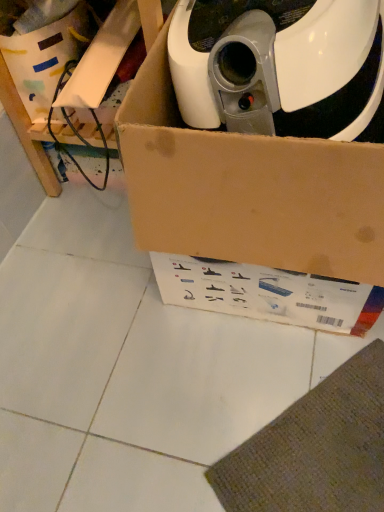
Describe the element at coordinates (248, 189) in the screenshot. The height and width of the screenshot is (512, 384). I see `brown cardboard box at upper center` at that location.

Locate an element on the screen. brown cardboard box at upper left is located at coordinates (108, 64).

The height and width of the screenshot is (512, 384). Identify the location of brown cardboard box at upper center. (248, 189).

Can you confirm if brown cardboard box at upper center is wider than white cardboard box at upper left?

Yes, brown cardboard box at upper center is wider than white cardboard box at upper left.

Is brown cardboard box at upper center to the right of white cardboard box at upper left from the viewer's perspective?

Yes.

Which is in front, brown cardboard box at upper center or white cardboard box at upper left?

brown cardboard box at upper center is in front.

Where is `storage box behind the brown cardboard box at upper center`? Image resolution: width=384 pixels, height=512 pixels. storage box behind the brown cardboard box at upper center is located at coordinates (43, 59).

Is brown cardboard box at upper left facing towards white cardboard box at upper left?

Yes, brown cardboard box at upper left faces towards white cardboard box at upper left.

Would you say brown cardboard box at upper left is outside white cardboard box at upper left?

Yes, brown cardboard box at upper left is not within white cardboard box at upper left.

How many degrees apart are the facing directions of brown cardboard box at upper left and white cardboard box at upper left?

5.06 degrees separate the facing orientations of brown cardboard box at upper left and white cardboard box at upper left.

Which is behind, brown cardboard box at upper left or white cardboard box at upper left?

white cardboard box at upper left is further away from the camera.

From a real-world perspective, is brown cardboard box at upper left beneath brown cardboard box at upper center?

Yes, from a real-world perspective, brown cardboard box at upper left is under brown cardboard box at upper center.

Looking at this image, is brown cardboard box at upper left shorter than brown cardboard box at upper center?

In fact, brown cardboard box at upper left may be taller than brown cardboard box at upper center.

Is brown cardboard box at upper left to the left of brown cardboard box at upper center from the viewer's perspective?

Indeed, brown cardboard box at upper left is positioned on the left side of brown cardboard box at upper center.

Does brown cardboard box at upper left come in front of brown cardboard box at upper center?

No, brown cardboard box at upper left is further to the viewer.

Is white cardboard box at upper left positioned before brown cardboard box at upper center?

No, white cardboard box at upper left is behind brown cardboard box at upper center.

Would you say white cardboard box at upper left contains brown cardboard box at upper center?

Actually, brown cardboard box at upper center is outside white cardboard box at upper left.

From a real-world perspective, between white cardboard box at upper left and brown cardboard box at upper center, who is vertically higher?

brown cardboard box at upper center is physically above.

Is white cardboard box at upper left shorter than brown cardboard box at upper center?

Correct, white cardboard box at upper left is not as tall as brown cardboard box at upper center.

Considering the sizes of objects white cardboard box at upper left and brown cardboard box at upper left in the image provided, who is thinner, white cardboard box at upper left or brown cardboard box at upper left?

Thinner between the two is white cardboard box at upper left.

From the image's perspective, is white cardboard box at upper left positioned above or below brown cardboard box at upper left?

Clearly, from the image's perspective, white cardboard box at upper left is above brown cardboard box at upper left.

Would you say white cardboard box at upper left is inside or outside brown cardboard box at upper left?

white cardboard box at upper left is contained in brown cardboard box at upper left.

Is brown cardboard box at upper center not near brown cardboard box at upper left?

No, brown cardboard box at upper center is in close proximity to brown cardboard box at upper left.

Is brown cardboard box at upper left a part of brown cardboard box at upper center?

No, brown cardboard box at upper left is not inside brown cardboard box at upper center.

Locate an element on the screen. The width and height of the screenshot is (384, 512). box in front of the white cardboard box at upper left is located at coordinates (248, 189).

I want to click on furniture below the white cardboard box at upper left (from the image's perspective), so click(x=108, y=64).

Looking at the image, which one is located closer to brown cardboard box at upper center, white cardboard box at upper left or brown cardboard box at upper left?

brown cardboard box at upper left is closer to brown cardboard box at upper center.

Based on their spatial positions, is brown cardboard box at upper left or brown cardboard box at upper center further from white cardboard box at upper left?

The object further to white cardboard box at upper left is brown cardboard box at upper center.

When comparing their distances from brown cardboard box at upper center, does brown cardboard box at upper left or white cardboard box at upper left seem further?

The object further to brown cardboard box at upper center is white cardboard box at upper left.

Which object lies nearer to the anchor point white cardboard box at upper left, brown cardboard box at upper center or brown cardboard box at upper left?

brown cardboard box at upper left is positioned closer to the anchor white cardboard box at upper left.

Estimate the real-world distances between objects in this image. Which object is further from brown cardboard box at upper left, brown cardboard box at upper center or white cardboard box at upper left?

Based on the image, brown cardboard box at upper center appears to be further to brown cardboard box at upper left.

Estimate the real-world distances between objects in this image. Which object is further from brown cardboard box at upper left, white cardboard box at upper left or brown cardboard box at upper center?

brown cardboard box at upper center lies further to brown cardboard box at upper left than the other object.

The image size is (384, 512). I want to click on furniture between white cardboard box at upper left and brown cardboard box at upper center in the horizontal direction, so click(x=108, y=64).